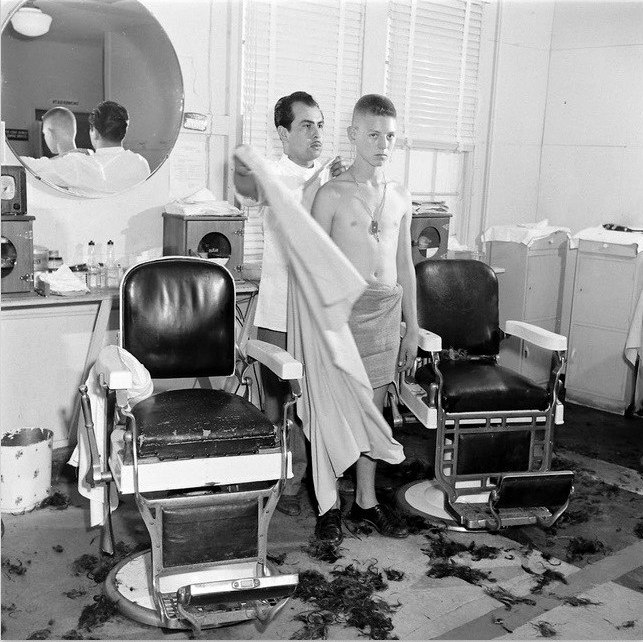
Where is `arm rests`? arm rests is located at coordinates (282, 352), (104, 370), (431, 340), (541, 334).